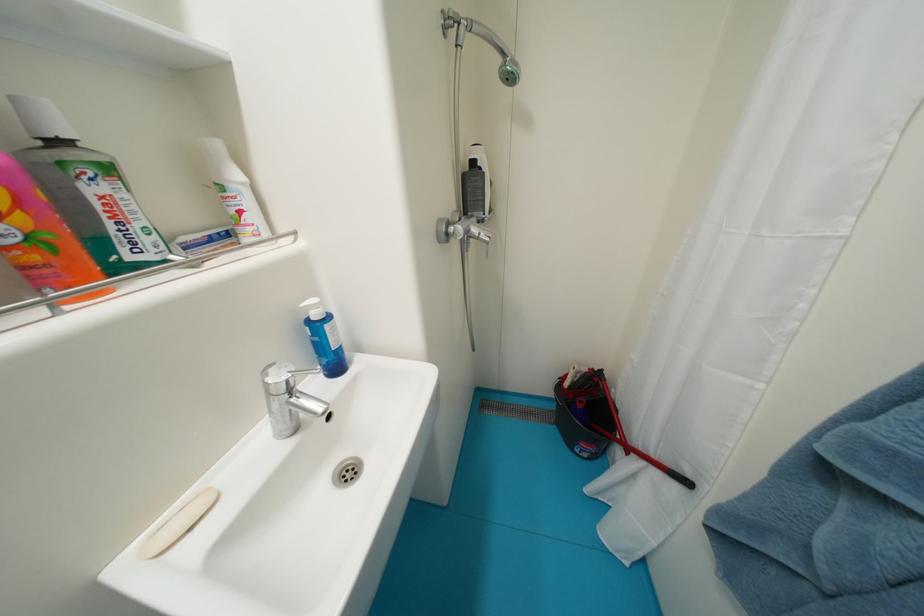
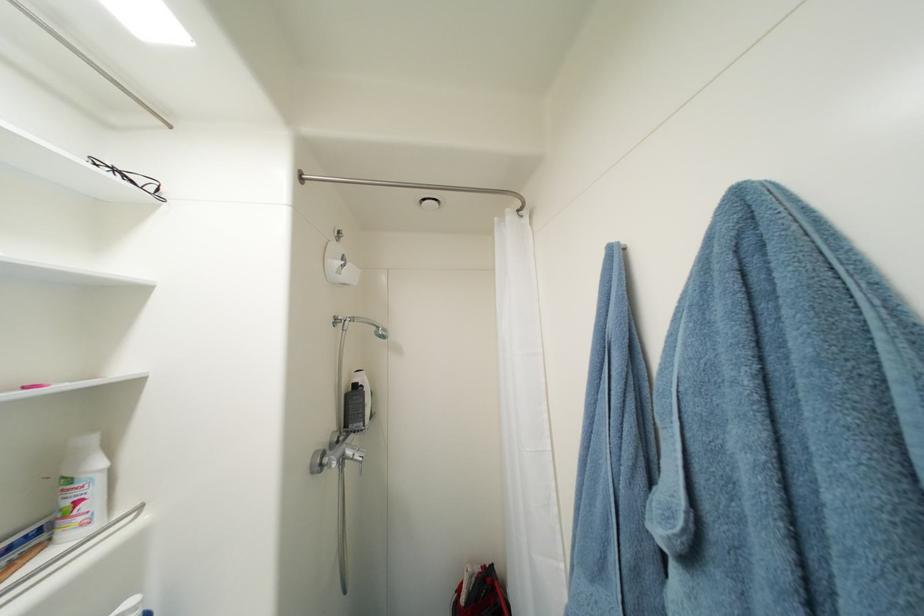
Question: I am providing you with two images of the same scene from different viewpoints. Please identify which objects are invisible in image2.

Choices:
 (A) black eyeglasses
 (B) white plastic bottle
 (C) blue robe loop
 (D) none of these

Answer: (D)